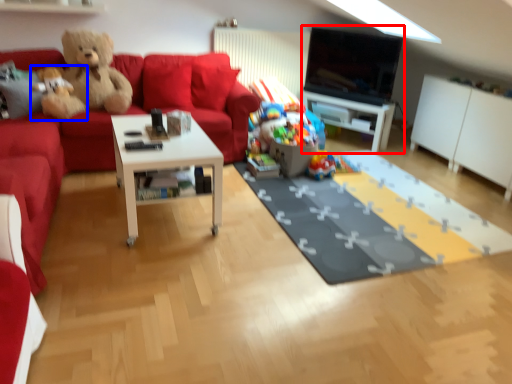
Question: Among these objects, which one is nearest to the camera, entertainment center (highlighted by a red box) or teddy bear (highlighted by a blue box)?

Choices:
 (A) entertainment center
 (B) teddy bear

Answer: (B)